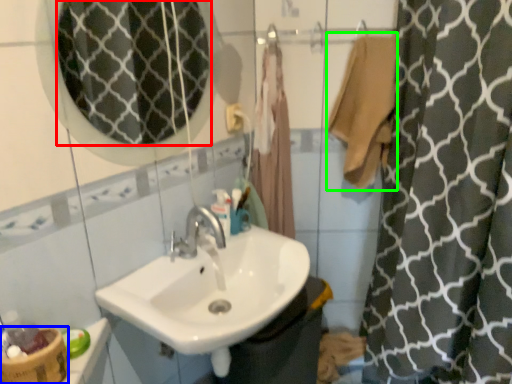
Question: Which object is the closest to the mirror (highlighted by a red box)? Choose among these: basket (highlighted by a blue box) or bath towel (highlighted by a green box).

Choices:
 (A) basket
 (B) bath towel

Answer: (B)